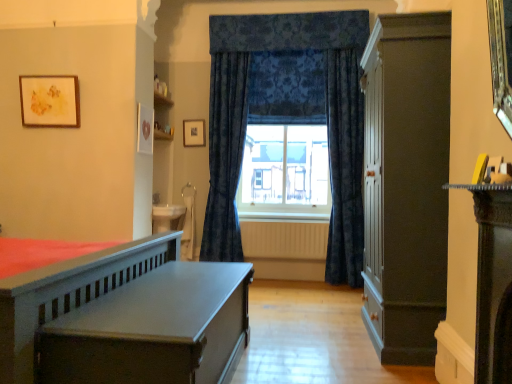
This screenshot has width=512, height=384. I want to click on dark blue velvet curtains at center, the second curtain viewed from the right, so click(225, 155).

The width and height of the screenshot is (512, 384). What do you see at coordinates (284, 239) in the screenshot?
I see `white textured radiator at center` at bounding box center [284, 239].

Identify the location of matte gray wooden bed at left. The image size is (512, 384). (125, 318).

What do you see at coordinates (50, 101) in the screenshot? I see `wooden picture frame at upper left, which is counted as the first picture frame, starting from the front` at bounding box center [50, 101].

What is the approximate height of wooden picture frame at upper left, which is counted as the first picture frame, starting from the front?

It is 17.98 inches.

Measure the distance between matte black picture frame at upper center, the first picture frame in the back-to-front sequence, and camera.

The depth of matte black picture frame at upper center, the first picture frame in the back-to-front sequence, is 4.64 meters.

Where is `matte black picture frame at upper center, the first picture frame in the back-to-front sequence`? This screenshot has width=512, height=384. matte black picture frame at upper center, the first picture frame in the back-to-front sequence is located at coordinates (194, 133).

This screenshot has height=384, width=512. Find the location of `matte dark brown cabinet at right`. matte dark brown cabinet at right is located at coordinates (406, 184).

Starting from the dark blue velvet curtains at center, the second curtain viewed from the right, which picture frame is the 2nd one to the left? Please provide its 2D coordinates.

[(50, 101)]

Looking at this image, relative to dark blue velvet curtains at center, the second curtain viewed from the right, is wooden picture frame at upper left, the 1th picture frame in the left-to-right sequence, in front or behind?

wooden picture frame at upper left, the 1th picture frame in the left-to-right sequence, is in front of dark blue velvet curtains at center, the second curtain viewed from the right.

From a real-world perspective, is wooden picture frame at upper left, which ranks as the 2th picture frame in right-to-left order, on dark blue velvet curtains at center, the second curtain viewed from the right?

Correct, in the physical world, wooden picture frame at upper left, which ranks as the 2th picture frame in right-to-left order, is higher than dark blue velvet curtains at center, the second curtain viewed from the right.

Considering the relative sizes of wooden picture frame at upper left, which ranks as the 2th picture frame in right-to-left order, and dark blue velvet curtains at center, the second curtain viewed from the right, in the image provided, is wooden picture frame at upper left, which ranks as the 2th picture frame in right-to-left order, shorter than dark blue velvet curtains at center, the second curtain viewed from the right,?

Correct, wooden picture frame at upper left, which ranks as the 2th picture frame in right-to-left order, is not as tall as dark blue velvet curtains at center, the second curtain viewed from the right.

Is matte black picture frame at upper center, the first picture frame in the back-to-front sequence, shorter than matte gray wooden bed at left?

Yes, matte black picture frame at upper center, the first picture frame in the back-to-front sequence, is shorter than matte gray wooden bed at left.

Is matte gray wooden bed at left completely or partially inside matte black picture frame at upper center, which ranks as the first picture frame in right-to-left order?

No.

From the image's perspective, which one is positioned lower, matte black picture frame at upper center, the first picture frame in the back-to-front sequence, or matte gray wooden bed at left?

matte gray wooden bed at left.

Does matte black picture frame at upper center, which ranks as the first picture frame in right-to-left order, touch matte gray wooden bed at left?

No, matte black picture frame at upper center, which ranks as the first picture frame in right-to-left order, is not in contact with matte gray wooden bed at left.

From the image's perspective, is white textured radiator at center above wooden picture frame at upper left, the 1th picture frame in the left-to-right sequence?

No, from the image's perspective, white textured radiator at center is not on top of wooden picture frame at upper left, the 1th picture frame in the left-to-right sequence.

Considering the points (311, 243) and (41, 96), which point is in front, point (311, 243) or point (41, 96)?

Point (41, 96)

From a real-world perspective, does white textured radiator at center sit lower than wooden picture frame at upper left, which ranks as the 2th picture frame in right-to-left order?

Yes, from a real-world perspective, white textured radiator at center is under wooden picture frame at upper left, which ranks as the 2th picture frame in right-to-left order.

Could wooden picture frame at upper left, which is counted as the first picture frame, starting from the front, be considered to be inside white textured radiator at center?

No, wooden picture frame at upper left, which is counted as the first picture frame, starting from the front, is not inside white textured radiator at center.

Could you tell me if dark blue velvet curtains at center, the second curtain viewed from the right, is turned towards white textured radiator at center?

No, dark blue velvet curtains at center, the second curtain viewed from the right, does not turn towards white textured radiator at center.

From a real-world perspective, which is physically above, dark blue velvet curtains at center, the second curtain viewed from the right, or white textured radiator at center?

From a 3D spatial view, dark blue velvet curtains at center, the second curtain viewed from the right, is above.

Who is shorter, dark blue velvet curtains at center, the second curtain viewed from the right, or white textured radiator at center?

Standing shorter between the two is white textured radiator at center.

Is dark blue velvet curtains at center, the second curtain viewed from the right, with white textured radiator at center?

They are not placed beside each other.

How many degrees apart are the facing directions of white textured radiator at center and matte gray wooden bed at left?

89.5 degrees separate the facing orientations of white textured radiator at center and matte gray wooden bed at left.

From a real-world perspective, which is physically below, white textured radiator at center or matte gray wooden bed at left?

From a 3D spatial view, matte gray wooden bed at left is below.

Could you tell me if white textured radiator at center is turned towards matte gray wooden bed at left?

Yes, white textured radiator at center is aimed at matte gray wooden bed at left.

The width and height of the screenshot is (512, 384). I want to click on bed lying on the left of white textured radiator at center, so click(125, 318).

Is velvet dark blue curtain at center, which is counted as the 1th curtain, starting from the right, positioned with its back to matte dark brown cabinet at right?

No, velvet dark blue curtain at center, which is counted as the 1th curtain, starting from the right, is not facing away from matte dark brown cabinet at right.

Looking at this image, considering the sizes of objects velvet dark blue curtain at center, which is counted as the 1th curtain, starting from the right, and matte dark brown cabinet at right in the image provided, who is shorter, velvet dark blue curtain at center, which is counted as the 1th curtain, starting from the right, or matte dark brown cabinet at right?

Standing shorter between the two is matte dark brown cabinet at right.

Is point (357, 118) less distant than point (435, 299)?

No, (357, 118) is further to viewer.

From a real-world perspective, is velvet dark blue curtain at center, which is counted as the 1th curtain, starting from the right, beneath matte dark brown cabinet at right?

Actually, velvet dark blue curtain at center, which is counted as the 1th curtain, starting from the right, is physically above matte dark brown cabinet at right in the real world.

Is wooden picture frame at upper left, which is the 2th picture frame from back to front, wider or thinner than white textured radiator at center?

wooden picture frame at upper left, which is the 2th picture frame from back to front, is wider than white textured radiator at center.

Between wooden picture frame at upper left, the 1th picture frame in the left-to-right sequence, and white textured radiator at center, which one appears on the left side from the viewer's perspective?

wooden picture frame at upper left, the 1th picture frame in the left-to-right sequence, is more to the left.

From their relative heights in the image, would you say wooden picture frame at upper left, the 1th picture frame in the left-to-right sequence, is taller or shorter than white textured radiator at center?

wooden picture frame at upper left, the 1th picture frame in the left-to-right sequence, is taller than white textured radiator at center.

At what (x,y) coordinates should I click in order to perform the action: click on the 2nd picture frame to the left when counting from the dark blue velvet curtains at center, acting as the first curtain starting from the left. Please return your answer as a coordinate pair (x, y). The width and height of the screenshot is (512, 384). Looking at the image, I should click on (50, 101).

The height and width of the screenshot is (384, 512). What are the coordinates of `picture frame that is the 2nd one when counting backward from the matte gray wooden bed at left` in the screenshot? It's located at (194, 133).

When comparing their distances from matte black picture frame at upper center, the first picture frame in the back-to-front sequence, does wooden picture frame at upper left, which is the 2th picture frame from back to front, or velvet dark blue curtain at center, which is counted as the 1th curtain, starting from the right, seem further?

velvet dark blue curtain at center, which is counted as the 1th curtain, starting from the right, lies further to matte black picture frame at upper center, the first picture frame in the back-to-front sequence, than the other object.

Which object lies further to the anchor point dark blue velvet curtains at center, acting as the first curtain starting from the left, matte dark brown cabinet at right or wooden picture frame at upper left, which is the 2th picture frame from back to front?

matte dark brown cabinet at right is further to dark blue velvet curtains at center, acting as the first curtain starting from the left.

From the image, which object appears to be farther from matte dark brown cabinet at right, white textured radiator at center or matte black picture frame at upper center, the 2th picture frame when ordered from front to back?

matte black picture frame at upper center, the 2th picture frame when ordered from front to back, lies further to matte dark brown cabinet at right than the other object.

Based on their spatial positions, is matte gray wooden bed at left or wooden picture frame at upper left, which ranks as the 2th picture frame in right-to-left order, closer to velvet dark blue curtain at center, which is counted as the 1th curtain, starting from the right?

matte gray wooden bed at left is positioned closer to the anchor velvet dark blue curtain at center, which is counted as the 1th curtain, starting from the right.

Considering their positions, is wooden picture frame at upper left, the 1th picture frame in the left-to-right sequence, positioned further to matte black picture frame at upper center, which ranks as the first picture frame in right-to-left order, than white textured radiator at center?

wooden picture frame at upper left, the 1th picture frame in the left-to-right sequence, is further to matte black picture frame at upper center, which ranks as the first picture frame in right-to-left order.

Based on their spatial positions, is dark blue velvet curtains at center, the second curtain viewed from the right, or wooden picture frame at upper left, which is counted as the first picture frame, starting from the front, closer to white textured radiator at center?

dark blue velvet curtains at center, the second curtain viewed from the right, is closer to white textured radiator at center.

Looking at the image, which one is located closer to wooden picture frame at upper left, which is the 2th picture frame from back to front, matte black picture frame at upper center, the 2th picture frame when ordered from left to right, or matte gray wooden bed at left?

matte black picture frame at upper center, the 2th picture frame when ordered from left to right, lies closer to wooden picture frame at upper left, which is the 2th picture frame from back to front, than the other object.

When comparing their distances from matte black picture frame at upper center, the first picture frame in the back-to-front sequence, does white textured radiator at center or matte gray wooden bed at left seem closer?

white textured radiator at center.

I want to click on curtain situated between matte black picture frame at upper center, the first picture frame in the back-to-front sequence, and velvet dark blue curtain at center, which is the 2th curtain in left-to-right order, from left to right, so click(225, 155).

You are a GUI agent. You are given a task and a screenshot of the screen. Output one action in this format:
    pyautogui.click(x=<x>, y=<y>)
    Task: Click on the curtain between wooden picture frame at upper left, which is the 2th picture frame from back to front, and white textured radiator at center
    This screenshot has height=384, width=512.
    Given the screenshot: What is the action you would take?
    pyautogui.click(x=225, y=155)

You are a GUI agent. You are given a task and a screenshot of the screen. Output one action in this format:
    pyautogui.click(x=<x>, y=<y>)
    Task: Click on the radiator situated between dark blue velvet curtains at center, acting as the first curtain starting from the left, and velvet dark blue curtain at center, which is the 2th curtain in left-to-right order, from left to right
    
    Given the screenshot: What is the action you would take?
    pyautogui.click(x=284, y=239)

I want to click on radiator between matte gray wooden bed at left and matte black picture frame at upper center, the 2th picture frame when ordered from front to back, along the z-axis, so click(x=284, y=239).